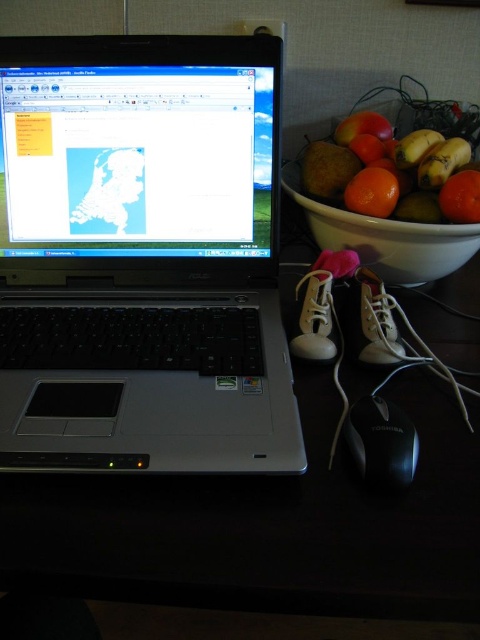
Between point (301, 179) and point (352, 429), which one is positioned behind?

Positioned behind is point (301, 179).

Can you confirm if shiny orange fruit at right is thinner than black plastic mouse at lower right?

No.

Is point (406, 156) farther from viewer compared to point (372, 428)?

Yes, point (406, 156) is farther from viewer.

Identify the location of shiny orange fruit at right. The height and width of the screenshot is (640, 480). (394, 172).

Does silver/black plastic laptop at left have a lesser height compared to shiny orange fruit at right?

No.

Which of these two, silver/black plastic laptop at left or shiny orange fruit at right, stands shorter?

With less height is shiny orange fruit at right.

The width and height of the screenshot is (480, 640). I want to click on silver/black plastic laptop at left, so click(x=142, y=257).

Can you confirm if black plastic table at lower center is shorter than shiny orange fruit at right?

In fact, black plastic table at lower center may be taller than shiny orange fruit at right.

Measure the distance between black plastic table at lower center and shiny orange fruit at right.

They are 8.92 inches apart.

You are a GUI agent. You are given a task and a screenshot of the screen. Output one action in this format:
    pyautogui.click(x=<x>, y=<y>)
    Task: Click on the black plastic table at lower center
    
    Given the screenshot: What is the action you would take?
    pyautogui.click(x=267, y=525)